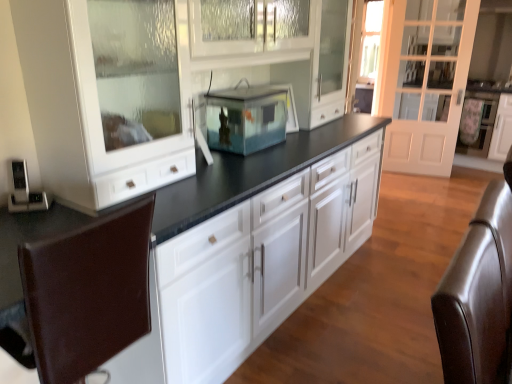
Question: Does brown leather swivel chair at lower left, the second swivel chair when ordered from right to left, have a lesser height compared to brown leather swivel chair at right, the 2th swivel chair viewed from the left?

Choices:
 (A) yes
 (B) no

Answer: (A)

Question: Does brown leather swivel chair at lower left, the second swivel chair when ordered from right to left, come in front of brown leather swivel chair at right, marked as the 1th swivel chair in a right-to-left arrangement?

Choices:
 (A) no
 (B) yes

Answer: (B)

Question: From a real-world perspective, is brown leather swivel chair at lower left, the second swivel chair when ordered from right to left, on brown leather swivel chair at right, marked as the 1th swivel chair in a right-to-left arrangement?

Choices:
 (A) yes
 (B) no

Answer: (B)

Question: Is the position of brown leather swivel chair at lower left, which is counted as the first swivel chair, starting from the left, more distant than that of brown leather swivel chair at right, the 2th swivel chair viewed from the left?

Choices:
 (A) no
 (B) yes

Answer: (A)

Question: From a real-world perspective, is brown leather swivel chair at lower left, the second swivel chair when ordered from right to left, located beneath brown leather swivel chair at right, marked as the 1th swivel chair in a right-to-left arrangement?

Choices:
 (A) yes
 (B) no

Answer: (A)

Question: Would you say brown leather swivel chair at lower left, the second swivel chair when ordered from right to left, is outside brown leather swivel chair at right, marked as the 1th swivel chair in a right-to-left arrangement?

Choices:
 (A) yes
 (B) no

Answer: (A)

Question: Is brown leather swivel chair at lower left, the second swivel chair when ordered from right to left, further to camera compared to transparent glass fish tank at center?

Choices:
 (A) yes
 (B) no

Answer: (B)

Question: Are brown leather swivel chair at lower left, which is counted as the first swivel chair, starting from the left, and transparent glass fish tank at center far apart?

Choices:
 (A) yes
 (B) no

Answer: (A)

Question: From the image's perspective, is brown leather swivel chair at lower left, the second swivel chair when ordered from right to left, located above transparent glass fish tank at center?

Choices:
 (A) no
 (B) yes

Answer: (A)

Question: From the image's perspective, is brown leather swivel chair at lower left, which is counted as the first swivel chair, starting from the left, beneath transparent glass fish tank at center?

Choices:
 (A) no
 (B) yes

Answer: (B)

Question: From a real-world perspective, does brown leather swivel chair at lower left, which is counted as the first swivel chair, starting from the left, stand above transparent glass fish tank at center?

Choices:
 (A) no
 (B) yes

Answer: (A)

Question: From a real-world perspective, is brown leather swivel chair at lower left, which is counted as the first swivel chair, starting from the left, located beneath transparent glass fish tank at center?

Choices:
 (A) no
 (B) yes

Answer: (B)

Question: From the image's perspective, does white glass door at right appear higher than brown leather swivel chair at right, marked as the 1th swivel chair in a right-to-left arrangement?

Choices:
 (A) no
 (B) yes

Answer: (B)